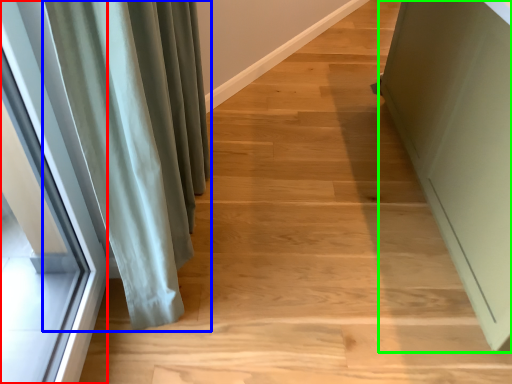
Question: Estimate the real-world distances between objects in this image. Which object is closer to window (highlighted by a red box), curtain (highlighted by a blue box) or screen door (highlighted by a green box)?

Choices:
 (A) curtain
 (B) screen door

Answer: (A)